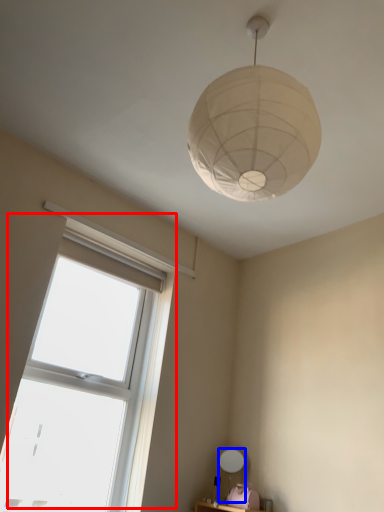
Question: Which object appears closest to the camera in this image, window (highlighted by a red box) or table lamp (highlighted by a blue box)?

Choices:
 (A) window
 (B) table lamp

Answer: (A)